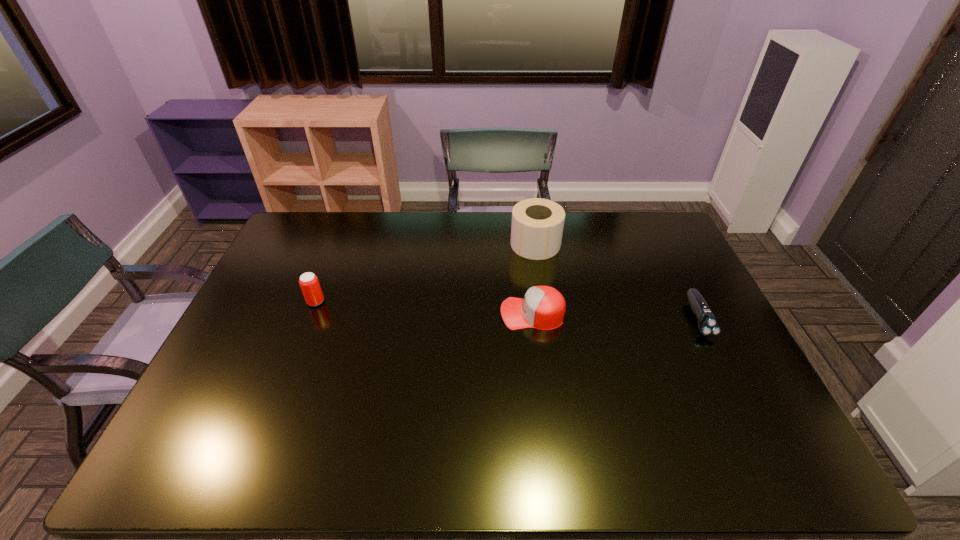
This screenshot has width=960, height=540. Find the location of `the farthest object`. the farthest object is located at coordinates (537, 225).

Find the location of `the tallest object`. the tallest object is located at coordinates (537, 225).

You are a GUI agent. You are given a task and a screenshot of the screen. Output one action in this format:
    pyautogui.click(x=<x>, y=<y>)
    Task: Click on the third shortest object
    
    Given the screenshot: What is the action you would take?
    pyautogui.click(x=309, y=283)

Identify the location of the leftmost object. This screenshot has width=960, height=540. (309, 283).

Locate an element on the screen. The image size is (960, 540). baseball cap is located at coordinates (543, 307).

The height and width of the screenshot is (540, 960). Find the location of `the shortest object`. the shortest object is located at coordinates (708, 326).

Locate an element on the screen. This screenshot has width=960, height=540. the rightmost object is located at coordinates (708, 326).

Find the location of a particular element. Image resolution: width=960 pixels, height=540 pixels. vacant space situated on the front of the farthest object is located at coordinates (540, 278).

The image size is (960, 540). Identify the location of free space located 0.240m on the front of the leftmost object. (288, 373).

At what (x,y) coordinates should I click in order to perform the action: click on free space located on the front-facing side of the baseball cap. Please return your answer as a coordinate pair (x, y). Looking at the image, I should click on (441, 314).